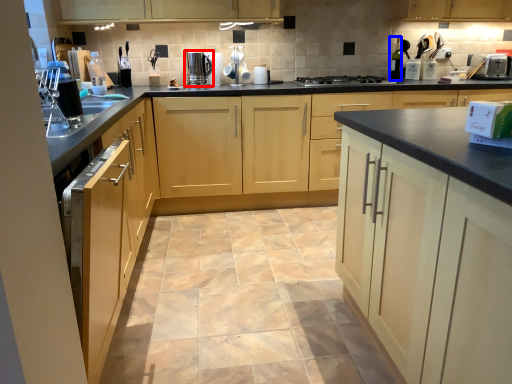
Question: Which of the following is the farthest to the observer, home appliance (highlighted by a red box) or bottle (highlighted by a blue box)?

Choices:
 (A) home appliance
 (B) bottle

Answer: (B)